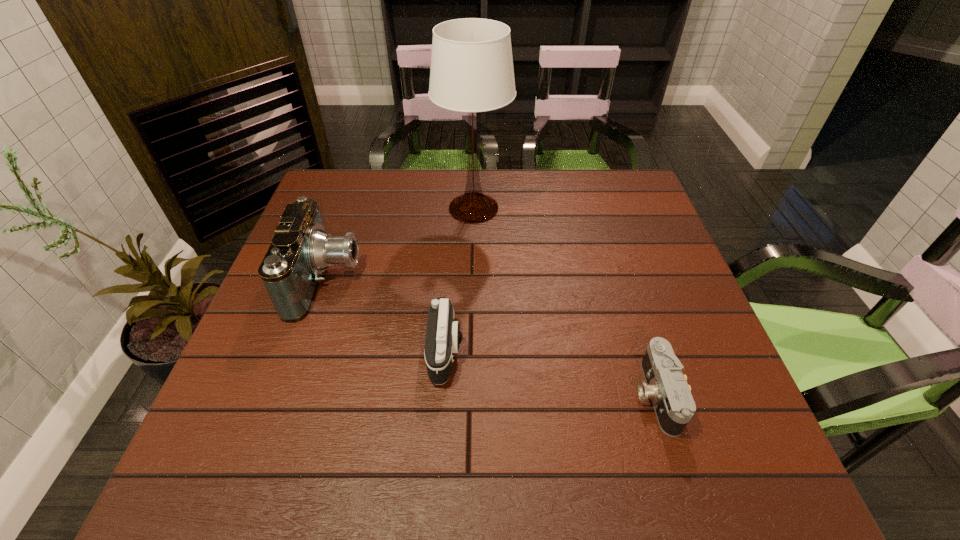
Image resolution: width=960 pixels, height=540 pixels. What are the coordinates of `free space between the rightmost object and the camcorder` in the screenshot? It's located at (492, 337).

Where is `vacant space that is in between the third tallest object and the table lamp`? This screenshot has height=540, width=960. vacant space that is in between the third tallest object and the table lamp is located at coordinates (460, 280).

Image resolution: width=960 pixels, height=540 pixels. Find the location of `blank region between the left camera and the third shortest object`. blank region between the left camera and the third shortest object is located at coordinates (386, 315).

Find the location of a particular element. This screenshot has height=540, width=960. the second closest object to the leftmost object is located at coordinates (443, 336).

At what (x,y) coordinates should I click in order to perform the action: click on the closest object to the second shortest object. Please return your answer as a coordinate pair (x, y). Image resolution: width=960 pixels, height=540 pixels. Looking at the image, I should click on pyautogui.click(x=291, y=270).